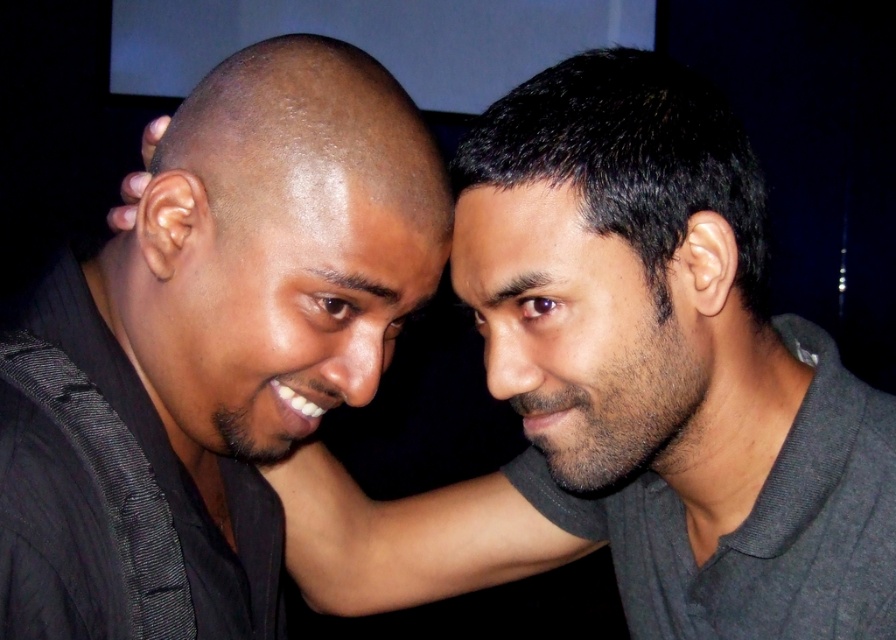
You are a photographer adjusting the focus of your camera. You want to ensure that both the black matte shirt at left and the smooth skin at center are in focus. Given that the depth of field can only sharply focus on one object at a time, which object should you focus on to maximize clarity for the closer subject?

The black matte shirt at left is closer to the viewer than the smooth skin at center. To maximize clarity for the closer subject, you should focus on the black matte shirt at left.

You are a photographer adjusting the focus of your camera. You have a point at coordinates (629, 387) that needs to be identified. Based on the scene, what object does this point correspond to?

The point at coordinates (629, 387) corresponds to the smooth black shirt at left.